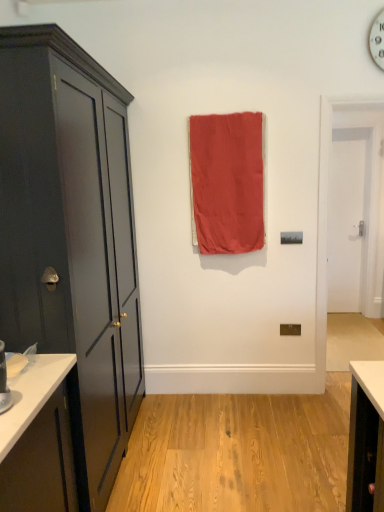
Question: From the image's perspective, is matte dark gray cabinet at left above white smooth door at right?

Choices:
 (A) yes
 (B) no

Answer: (B)

Question: Is matte dark gray cabinet at left to the left of white smooth door at right from the viewer's perspective?

Choices:
 (A) yes
 (B) no

Answer: (A)

Question: Does matte dark gray cabinet at left have a greater width compared to white smooth door at right?

Choices:
 (A) yes
 (B) no

Answer: (A)

Question: Are matte dark gray cabinet at left and white smooth door at right located far from each other?

Choices:
 (A) no
 (B) yes

Answer: (B)

Question: Can you confirm if matte dark gray cabinet at left is shorter than white smooth door at right?

Choices:
 (A) no
 (B) yes

Answer: (A)

Question: Is point (365, 126) positioned closer to the camera than point (251, 228)?

Choices:
 (A) closer
 (B) farther

Answer: (B)

Question: In the image, is white smooth door at right positioned in front of or behind coral fabric curtain at center?

Choices:
 (A) behind
 (B) front

Answer: (A)

Question: Looking at the image, does white smooth door at right seem bigger or smaller compared to coral fabric curtain at center?

Choices:
 (A) small
 (B) big

Answer: (A)

Question: Choose the correct answer: Is white smooth door at right inside coral fabric curtain at center or outside it?

Choices:
 (A) inside
 (B) outside

Answer: (B)

Question: From the image's perspective, is coral fabric curtain at center positioned above or below matte dark gray cabinet at left?

Choices:
 (A) above
 (B) below

Answer: (A)

Question: From a real-world perspective, is coral fabric curtain at center above or below matte dark gray cabinet at left?

Choices:
 (A) above
 (B) below

Answer: (A)

Question: Looking at their shapes, would you say coral fabric curtain at center is wider or thinner than matte dark gray cabinet at left?

Choices:
 (A) thin
 (B) wide

Answer: (A)

Question: Considering the positions of point (208, 129) and point (112, 279), is point (208, 129) closer or farther from the camera than point (112, 279)?

Choices:
 (A) closer
 (B) farther

Answer: (B)

Question: In terms of width, does coral fabric curtain at center look wider or thinner when compared to white smooth door at right?

Choices:
 (A) wide
 (B) thin

Answer: (A)

Question: In terms of height, does coral fabric curtain at center look taller or shorter compared to white smooth door at right?

Choices:
 (A) tall
 (B) short

Answer: (B)